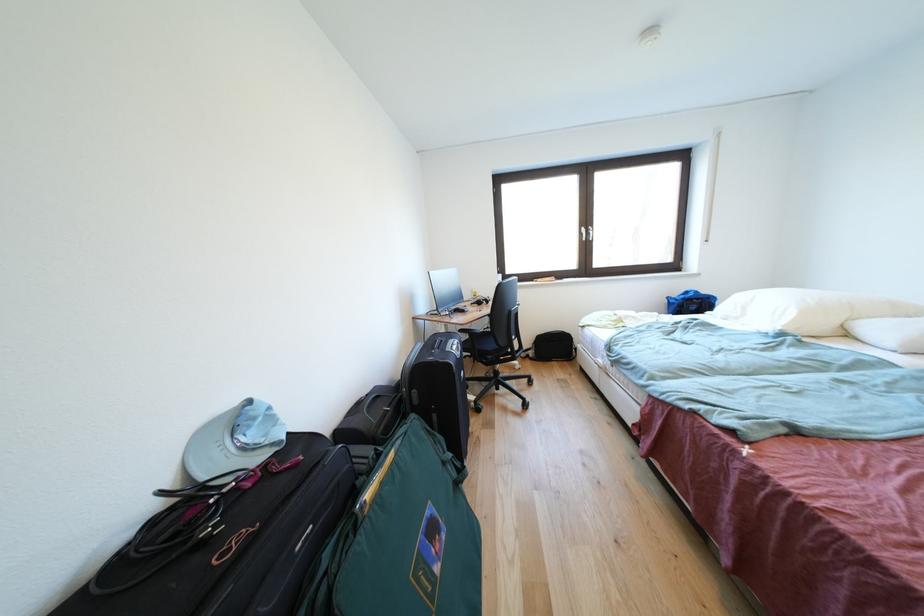
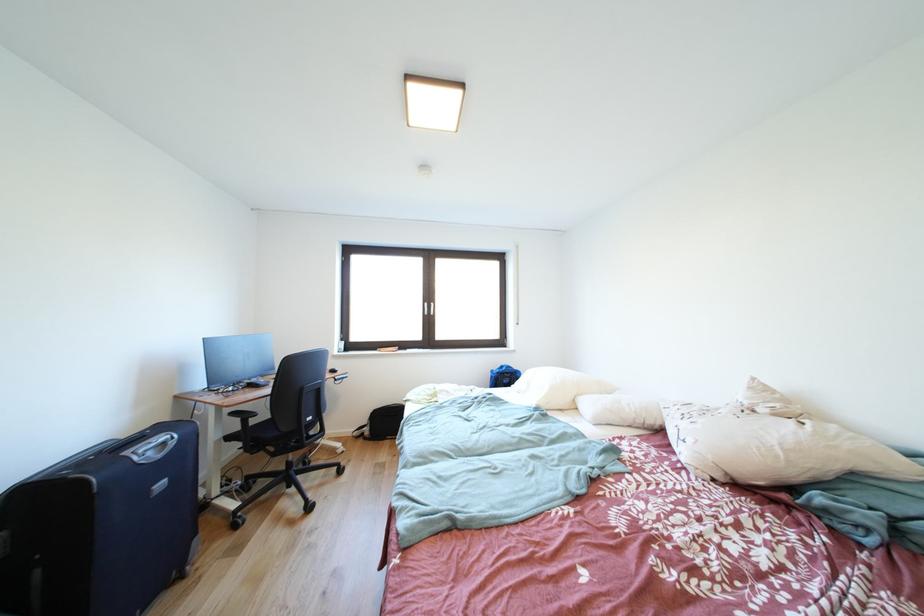
Question: The camera is either moving clockwise (left) or counter-clockwise (right) around the object. The first image is from the beginning of the video and the second image is from the end. Is the camera moving left or right when shooting the video?

Choices:
 (A) Left
 (B) Right

Answer: (A)